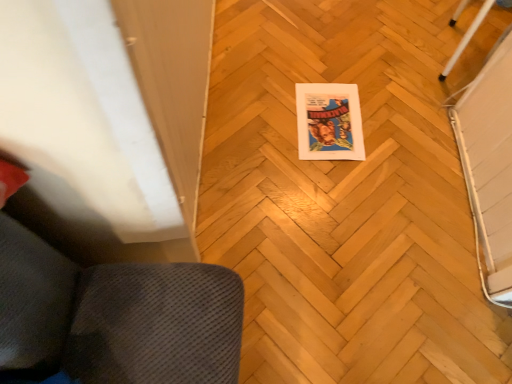
Question: Can you confirm if white glossy pole at upper right is thinner than wooden parquet floor at center?

Choices:
 (A) yes
 (B) no

Answer: (A)

Question: Does white glossy pole at upper right have a lesser height compared to wooden parquet floor at center?

Choices:
 (A) no
 (B) yes

Answer: (A)

Question: Is white glossy pole at upper right to the left of wooden parquet floor at center from the viewer's perspective?

Choices:
 (A) no
 (B) yes

Answer: (A)

Question: Considering the relative sizes of white glossy pole at upper right and wooden parquet floor at center in the image provided, is white glossy pole at upper right smaller than wooden parquet floor at center?

Choices:
 (A) yes
 (B) no

Answer: (A)

Question: From the image's perspective, would you say white glossy pole at upper right is positioned over wooden parquet floor at center?

Choices:
 (A) no
 (B) yes

Answer: (B)

Question: In terms of height, does matte paper comic book at center look taller or shorter compared to wooden parquet floor at center?

Choices:
 (A) tall
 (B) short

Answer: (B)

Question: Would you say matte paper comic book at center is to the left or to the right of wooden parquet floor at center in the picture?

Choices:
 (A) left
 (B) right

Answer: (A)

Question: Which is correct: matte paper comic book at center is inside wooden parquet floor at center, or outside of it?

Choices:
 (A) inside
 (B) outside

Answer: (A)

Question: Is point (325, 125) positioned closer to the camera than point (416, 268)?

Choices:
 (A) closer
 (B) farther

Answer: (B)

Question: Is matte paper comic book at center bigger or smaller than white glossy pole at upper right?

Choices:
 (A) big
 (B) small

Answer: (B)

Question: In terms of height, does matte paper comic book at center look taller or shorter compared to white glossy pole at upper right?

Choices:
 (A) short
 (B) tall

Answer: (A)

Question: From the image's perspective, is matte paper comic book at center positioned above or below white glossy pole at upper right?

Choices:
 (A) below
 (B) above

Answer: (A)

Question: Does point (329, 92) appear closer or farther from the camera than point (470, 31)?

Choices:
 (A) closer
 (B) farther

Answer: (A)

Question: Considering the relative positions of wooden parquet floor at center and white glossy pole at upper right in the image provided, is wooden parquet floor at center to the left or to the right of white glossy pole at upper right?

Choices:
 (A) right
 (B) left

Answer: (B)

Question: Is wooden parquet floor at center bigger or smaller than white glossy pole at upper right?

Choices:
 (A) small
 (B) big

Answer: (B)